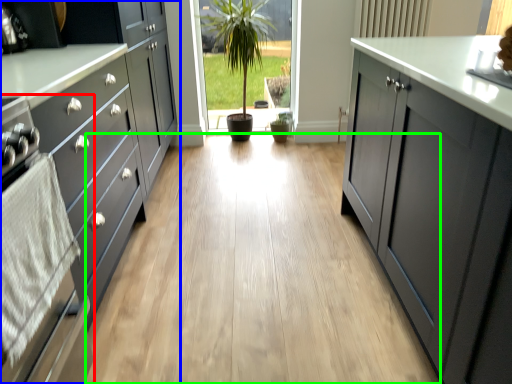
Question: Based on their relative distances, which object is nearer to oven (highlighted by a red box)? Choose from cabinetry (highlighted by a blue box) and plain (highlighted by a green box).

Choices:
 (A) cabinetry
 (B) plain

Answer: (A)